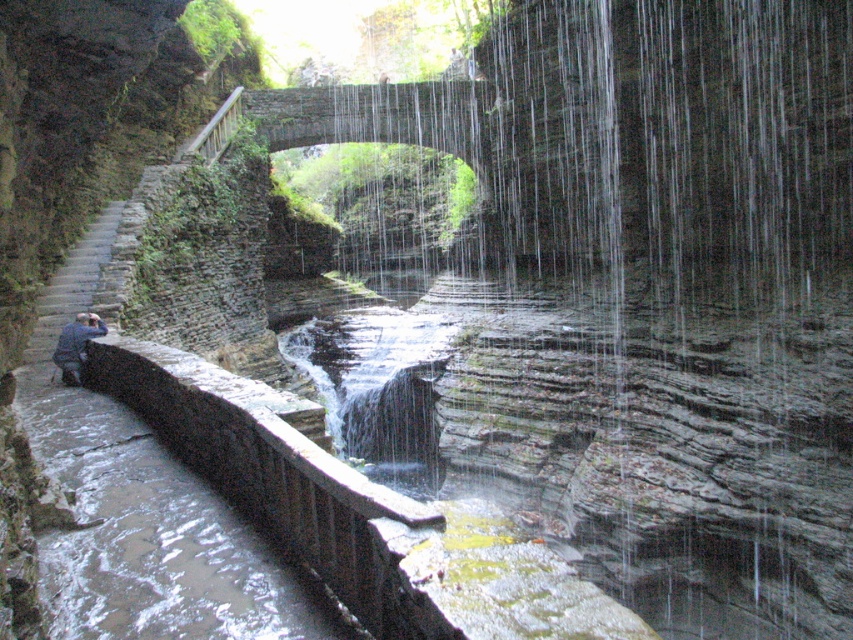
Which is behind, point (280, 502) or point (71, 346)?

Point (71, 346)

Can you confirm if brown stone rail at lower left is smaller than blue denim jacket at lower left?

No, brown stone rail at lower left is not smaller than blue denim jacket at lower left.

Locate an element on the screen. brown stone rail at lower left is located at coordinates pyautogui.click(x=276, y=474).

Is clear water at center closer to the viewer compared to brown stone rail at lower left?

That is False.

Which is below, clear water at center or brown stone rail at lower left?

Positioned lower is brown stone rail at lower left.

What do you see at coordinates (621, 429) in the screenshot?
I see `clear water at center` at bounding box center [621, 429].

At what (x,y) coordinates should I click in order to perform the action: click on clear water at center. Please return your answer as a coordinate pair (x, y). This screenshot has width=853, height=640. Looking at the image, I should click on 621,429.

Where is `clear water at center`? clear water at center is located at coordinates (621, 429).

Who is more forward, (x=718, y=321) or (x=68, y=364)?

Positioned in front is point (x=68, y=364).

Is point (647, 381) positioned behind point (71, 342)?

Yes, point (647, 381) is behind point (71, 342).

Locate an element on the screen. clear water at center is located at coordinates (621, 429).